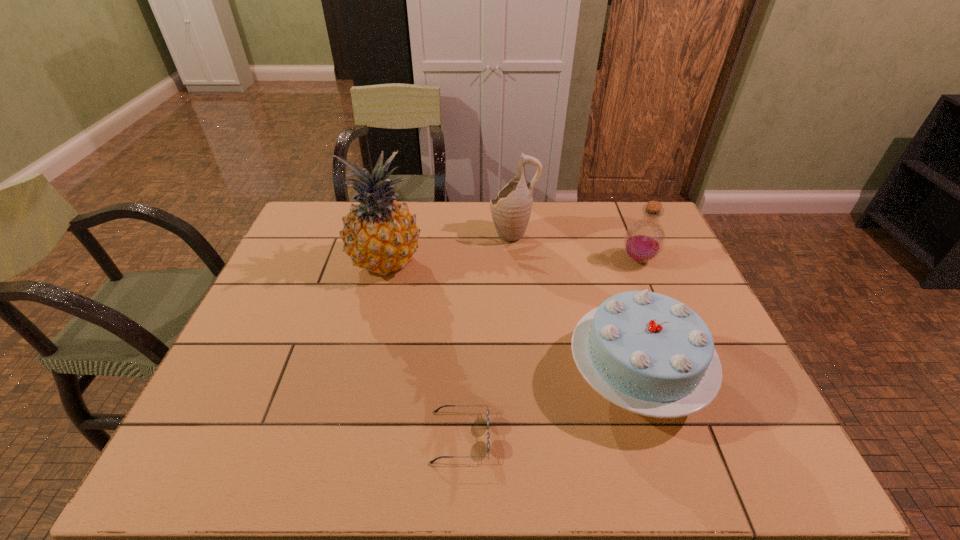
Image resolution: width=960 pixels, height=540 pixels. What are the coordinates of `empty location between the shortest object and the pitcher` in the screenshot? It's located at (487, 335).

At what (x,y) coordinates should I click in order to perform the action: click on vacant area that lies between the birthday cake and the pineapple. Please return your answer as a coordinate pair (x, y). Looking at the image, I should click on (511, 319).

Locate an element on the screen. free space between the fourth object from right to left and the birthday cake is located at coordinates (548, 406).

At what (x,y) coordinates should I click in order to perform the action: click on unoccupied position between the shortest object and the birthday cake. Please return your answer as a coordinate pair (x, y). The image size is (960, 540). Looking at the image, I should click on [x=548, y=406].

Find the location of a particular element. This screenshot has height=540, width=960. vacant space in between the bottle and the sunglasses is located at coordinates (549, 348).

Image resolution: width=960 pixels, height=540 pixels. What are the coordinates of `vacant space that is in between the bottle and the shortest object` in the screenshot? It's located at (549, 348).

In order to click on object that is the third closest to the bottle in this screenshot , I will do `click(380, 235)`.

At what (x,y) coordinates should I click in order to perform the action: click on object that stands as the closest to the bottle. Please return your answer as a coordinate pair (x, y). This screenshot has width=960, height=540. Looking at the image, I should click on (648, 353).

You are a GUI agent. You are given a task and a screenshot of the screen. Output one action in this format:
    pyautogui.click(x=<x>, y=<y>)
    Task: Click on the vacant space that satisfies the following two spatial constraints: 1. at the spout of the birthday cake; 2. on the left side of the pitcher
    The image size is (960, 540).
    Given the screenshot: What is the action you would take?
    pyautogui.click(x=526, y=375)

Locate an element on the screen. The width and height of the screenshot is (960, 540). vacant region that satisfies the following two spatial constraints: 1. at the spout of the third object from left to right; 2. on the back side of the bottle is located at coordinates (516, 260).